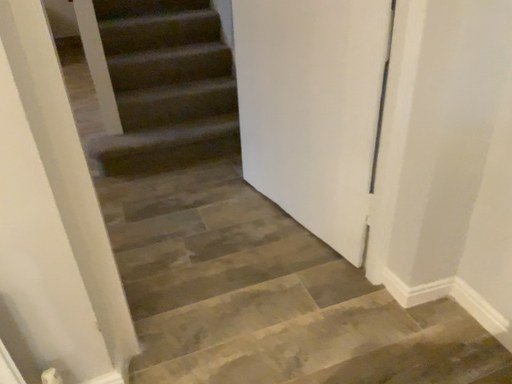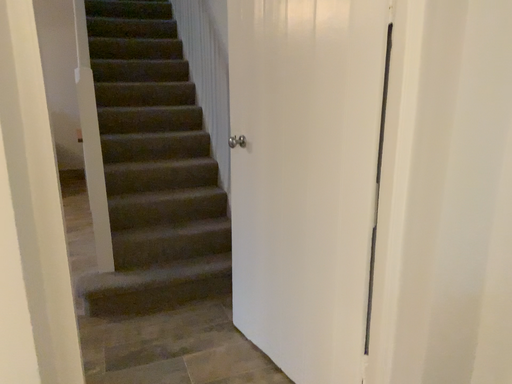
Question: How did the camera likely rotate when shooting the video?

Choices:
 (A) rotated downward
 (B) rotated upward

Answer: (B)